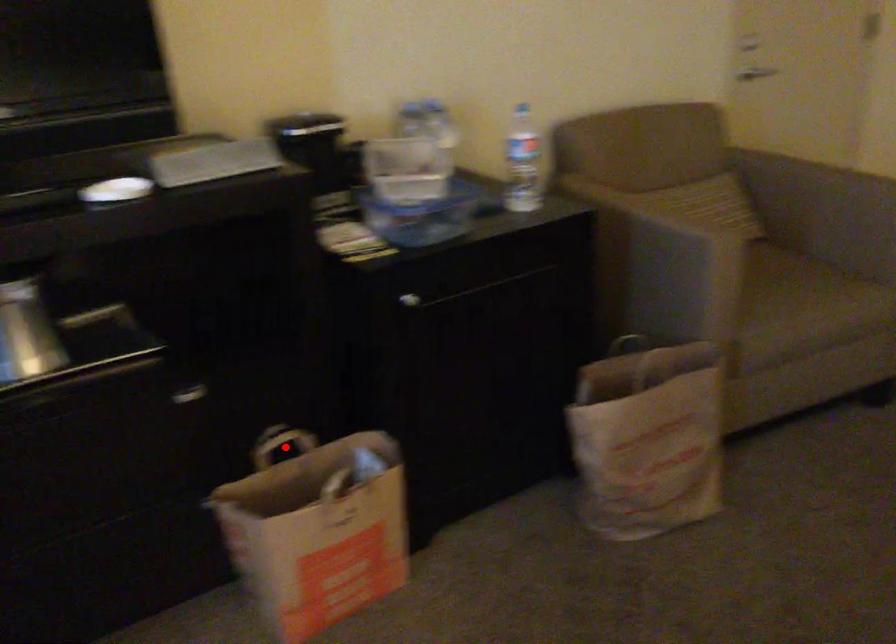
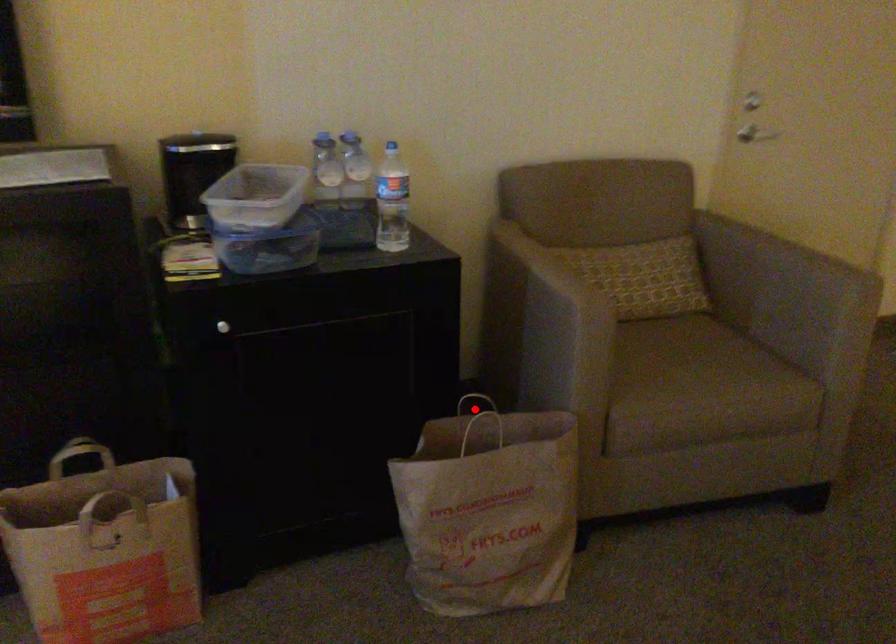
I am providing you with two images of the same scene from different viewpoints. A red point is marked on the first image and another point is marked on the second image. Does the point marked in image1 correspond to the same location as the one in image2?

No